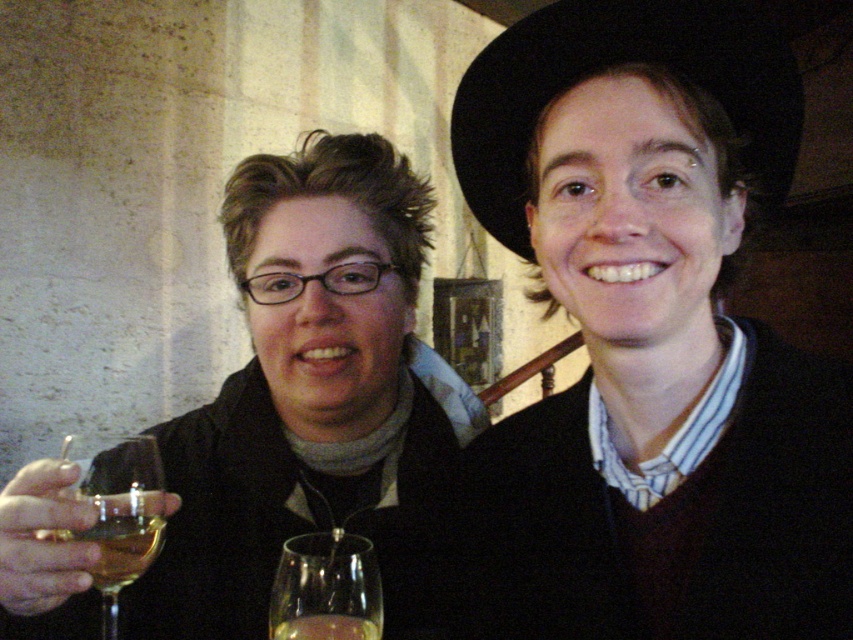
Which is more to the left, matte black jacket at left or clear glass wine glass at lower left?

Positioned to the left is clear glass wine glass at lower left.

What do you see at coordinates (308, 397) in the screenshot?
I see `matte black jacket at left` at bounding box center [308, 397].

The width and height of the screenshot is (853, 640). What do you see at coordinates (308, 397) in the screenshot? I see `matte black jacket at left` at bounding box center [308, 397].

The height and width of the screenshot is (640, 853). Find the location of `matte black jacket at left`. matte black jacket at left is located at coordinates (308, 397).

Can you confirm if matte black jacket at left is positioned below translucent glass wine at center?

Incorrect, matte black jacket at left is not positioned below translucent glass wine at center.

Between matte black jacket at left and translucent glass wine at center, which one has less height?

translucent glass wine at center

Does point (296, 422) lie behind point (338, 616)?

Yes, it is.

The image size is (853, 640). Find the location of `matte black jacket at left`. matte black jacket at left is located at coordinates (308, 397).

Measure the distance between point (88,497) and camera.

Point (88,497) and camera are 63.41 centimeters apart from each other.

Which is behind, point (128, 525) or point (277, 637)?

Point (128, 525)

Which is in front, point (146, 493) or point (325, 630)?

Positioned in front is point (325, 630).

The height and width of the screenshot is (640, 853). I want to click on clear glass wine glass at lower left, so click(x=117, y=509).